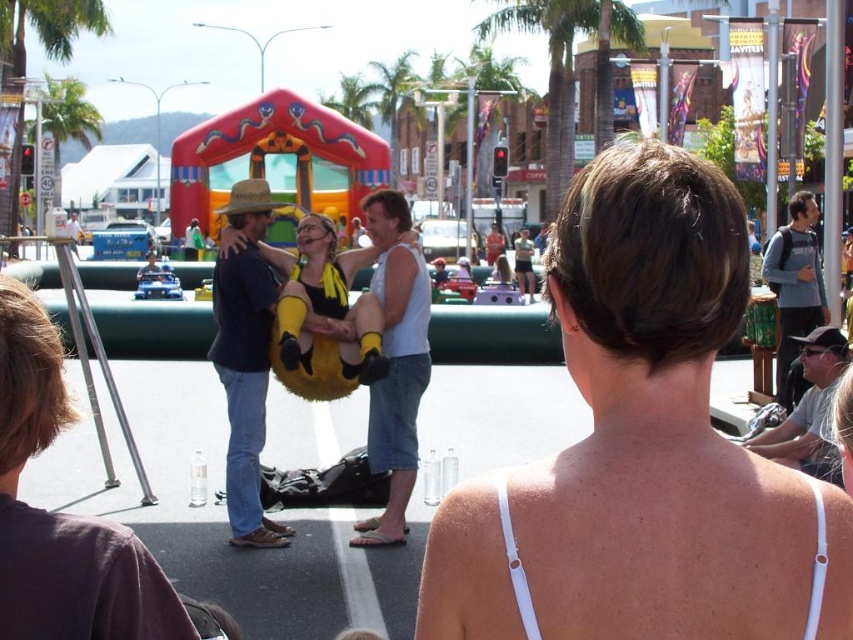
Question: Which point is farther to the camera?

Choices:
 (A) 311,314
 (B) 799,324

Answer: (B)

Question: In this image, where is matte black shirt at center located relative to yellow fuzzy costume at center?

Choices:
 (A) above
 (B) below

Answer: (B)

Question: Observing the image, what is the correct spatial positioning of white fabric bikini top at upper center in reference to yellow fuzzy costume at center?

Choices:
 (A) below
 (B) above

Answer: (A)

Question: Which of the following is the closest to the observer?

Choices:
 (A) white fabric bikini top at upper center
 (B) yellow fuzzy costume at center
 (C) gray cotton hoodie at upper right

Answer: (A)

Question: Observing the image, what is the correct spatial positioning of matte black shirt at center in reference to white tank top at center?

Choices:
 (A) below
 (B) above

Answer: (B)

Question: Which object is positioned farthest from the matte black shirt at center?

Choices:
 (A) yellow fuzzy costume at center
 (B) gray cotton hoodie at upper right
 (C) gray fabric cap at right

Answer: (B)